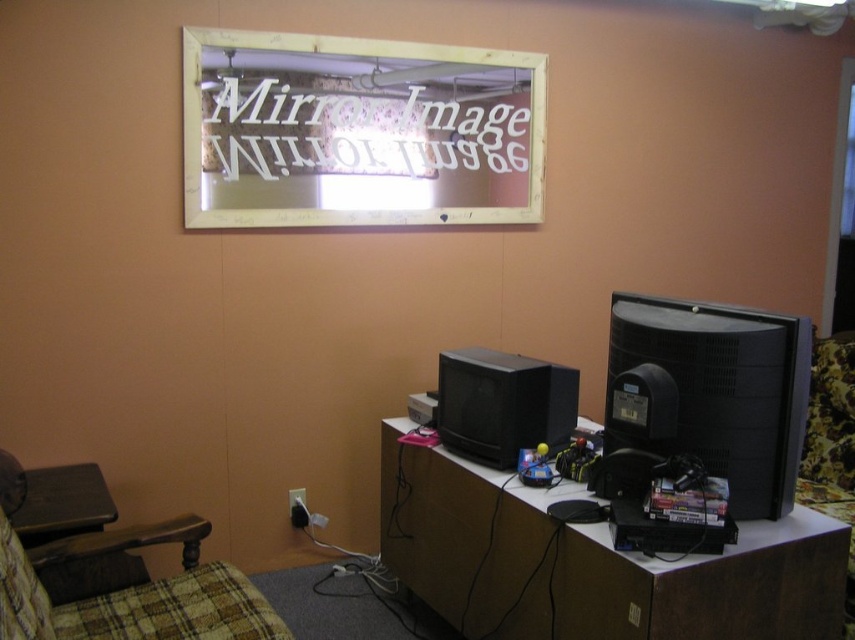
You are standing in front of the peach wall and want to place a new decorative item between the rectangular mirror with a light colored frame and the black matte computer monitor at right. How much space do you have available for placing the item?

The space between the rectangular mirror with a light colored frame and the black matte computer monitor at right is 1.74 meters, so you have 1.74 meters of space available for placing the item.

You are setting up a home theater system and need to place a new speaker between the black matte computer monitor at right and the brown wood table at lower left. Based on their positions, which object should the speaker be closer to?

The black matte computer monitor at right is positioned on the right side of the brown wood table at lower left, so the speaker should be placed closer to the brown wood table at lower left to maintain symmetry between the two objects.